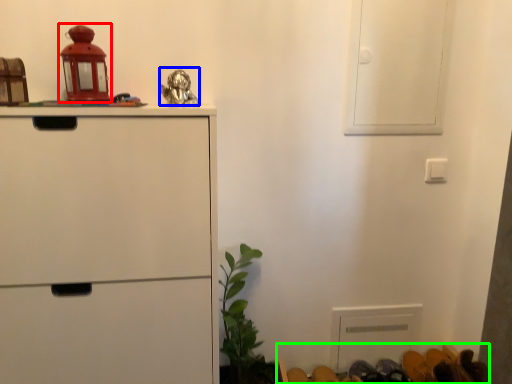
Question: Considering the real-world distances, which object is farthest from toy (highlighted by a red box)? toy (highlighted by a blue box) or furniture (highlighted by a green box)?

Choices:
 (A) toy
 (B) furniture

Answer: (B)